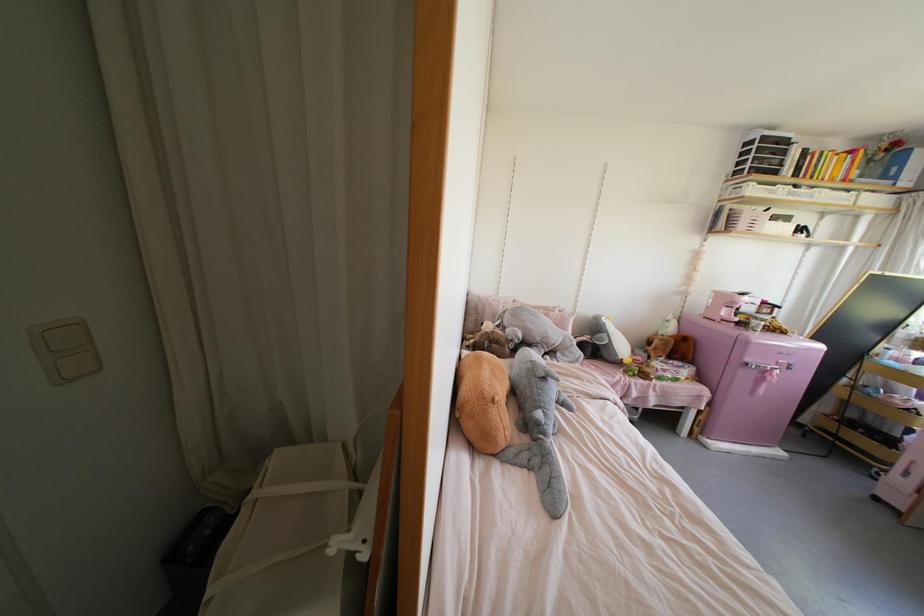
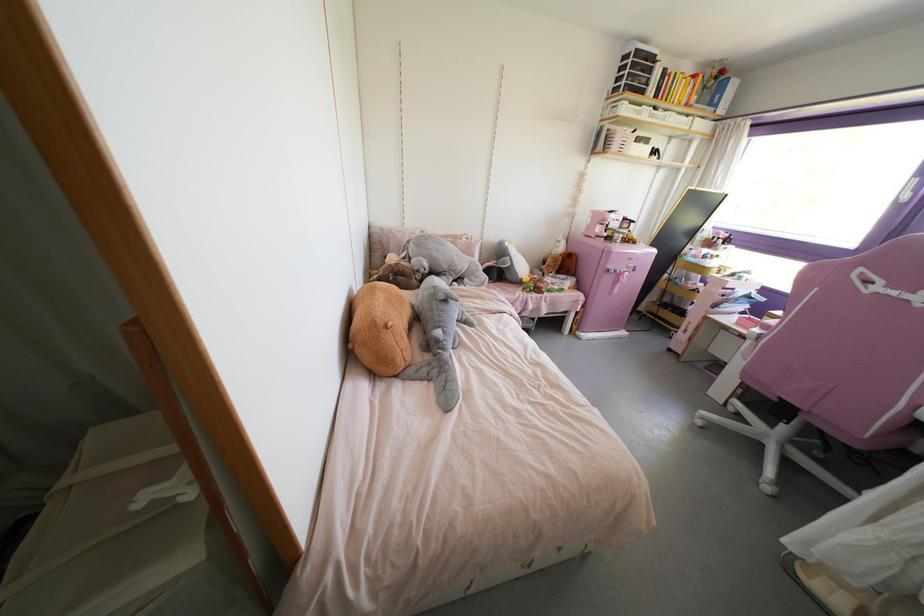
Where in the second image is the point corresponding to (x=576, y=360) from the first image?

(482, 284)